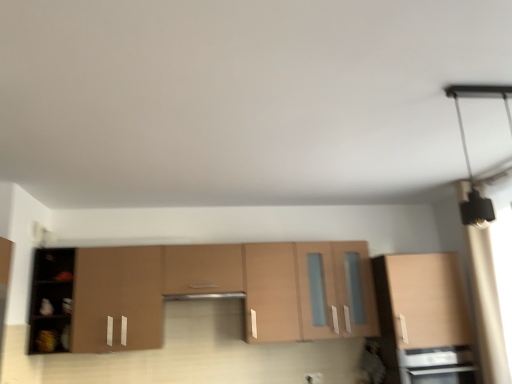
Question: From the image's perspective, is matte brown cabinet at center, which is the 2th cabinetry from right to left, above or below matte wood cabinet at right, the second cabinetry in the left-to-right sequence?

Choices:
 (A) above
 (B) below

Answer: (A)

Question: In the image, is matte brown cabinet at center, which is the 2th cabinetry from right to left, on the left side or the right side of matte wood cabinet at right, the second cabinetry in the left-to-right sequence?

Choices:
 (A) right
 (B) left

Answer: (B)

Question: Which of these objects is positioned closest to the black matte light fixture at upper right?

Choices:
 (A) satin silver exhaust hood at center
 (B) matte black oven at lower right
 (C) matte wood cabinet at right, the second cabinetry in the left-to-right sequence
 (D) matte brown cabinet at center, which is the 2th cabinetry from right to left

Answer: (C)

Question: Considering the real-world distances, which object is closest to the black matte light fixture at upper right?

Choices:
 (A) matte wood cabinet at right, the second cabinetry in the left-to-right sequence
 (B) matte black oven at lower right
 (C) matte brown cabinet at center, which is the 2th cabinetry from right to left
 (D) satin silver exhaust hood at center

Answer: (A)